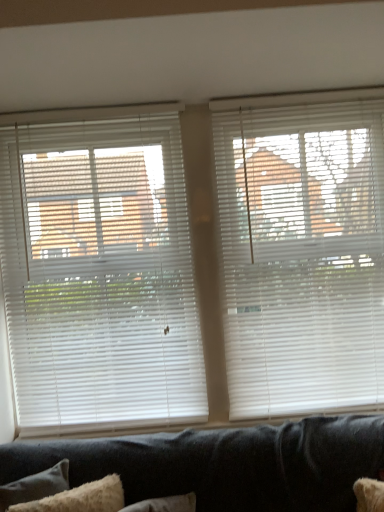
This screenshot has height=512, width=384. What do you see at coordinates (99, 272) in the screenshot? I see `white plastic blinds at left, marked as the 2th window blind in a right-to-left arrangement` at bounding box center [99, 272].

You are a GUI agent. You are given a task and a screenshot of the screen. Output one action in this format:
    pyautogui.click(x=<x>, y=<y>)
    Task: Click on the white plastic blinds at upper right, arranged as the second window blind when viewed from the left
    This screenshot has height=512, width=384.
    Given the screenshot: What is the action you would take?
    pyautogui.click(x=302, y=251)

Between white plastic blinds at left, marked as the 2th window blind in a right-to-left arrangement, and fuzzy white pillow at lower left, which one has less height?

fuzzy white pillow at lower left.

In terms of width, does white plastic blinds at left, the 1th window blind when ordered from left to right, look wider or thinner when compared to fuzzy white pillow at lower left?

white plastic blinds at left, the 1th window blind when ordered from left to right, is thinner than fuzzy white pillow at lower left.

Could you tell me if white plastic blinds at left, the 1th window blind when ordered from left to right, is turned towards fuzzy white pillow at lower left?

Yes.

From the image's perspective, would you say white plastic blinds at left, the 1th window blind when ordered from left to right, is shown under fuzzy white pillow at lower left?

No, from the image's perspective, white plastic blinds at left, the 1th window blind when ordered from left to right, is not below fuzzy white pillow at lower left.

Which object is closer to the camera taking this photo, white plastic blinds at upper right, acting as the 1th window blind starting from the right, or white plastic blinds at left, the 1th window blind when ordered from left to right?

white plastic blinds at upper right, acting as the 1th window blind starting from the right.

Which is correct: white plastic blinds at upper right, arranged as the second window blind when viewed from the left, is inside white plastic blinds at left, the 1th window blind when ordered from left to right, or outside of it?

white plastic blinds at upper right, arranged as the second window blind when viewed from the left, exists outside the volume of white plastic blinds at left, the 1th window blind when ordered from left to right.

From the image's perspective, does white plastic blinds at upper right, acting as the 1th window blind starting from the right, appear higher than white plastic blinds at left, the 1th window blind when ordered from left to right?

Yes, from the image's perspective, white plastic blinds at upper right, acting as the 1th window blind starting from the right, is on top of white plastic blinds at left, the 1th window blind when ordered from left to right.

Does point (55, 268) come closer to viewer compared to point (348, 396)?

Yes, it is in front of point (348, 396).

Is white plastic blinds at left, marked as the 2th window blind in a right-to-left arrangement, to the left or to the right of white plastic blinds at upper right, arranged as the second window blind when viewed from the left, in the image?

Based on their positions, white plastic blinds at left, marked as the 2th window blind in a right-to-left arrangement, is located to the left of white plastic blinds at upper right, arranged as the second window blind when viewed from the left.

Locate an element on the screen. The height and width of the screenshot is (512, 384). window blind in front of the white plastic blinds at left, marked as the 2th window blind in a right-to-left arrangement is located at coordinates (302, 251).

Considering the positions of objects white plastic blinds at upper right, acting as the 1th window blind starting from the right, and fuzzy white pillow at lower left in the image provided, who is behind, white plastic blinds at upper right, acting as the 1th window blind starting from the right, or fuzzy white pillow at lower left?

Positioned behind is white plastic blinds at upper right, acting as the 1th window blind starting from the right.

From a real-world perspective, who is located lower, white plastic blinds at upper right, arranged as the second window blind when viewed from the left, or fuzzy white pillow at lower left?

fuzzy white pillow at lower left is physically lower.

Is white plastic blinds at upper right, acting as the 1th window blind starting from the right, looking in the opposite direction of fuzzy white pillow at lower left?

No, white plastic blinds at upper right, acting as the 1th window blind starting from the right,'s orientation is not away from fuzzy white pillow at lower left.

Considering the positions of point (377, 162) and point (63, 501), is point (377, 162) closer or farther from the camera than point (63, 501)?

Point (377, 162).

Would you consider fuzzy white pillow at lower left to be distant from white plastic blinds at upper right, arranged as the second window blind when viewed from the left?

That's right, there is a large distance between fuzzy white pillow at lower left and white plastic blinds at upper right, arranged as the second window blind when viewed from the left.

Does fuzzy white pillow at lower left have a greater height compared to white plastic blinds at upper right, acting as the 1th window blind starting from the right?

Incorrect, the height of fuzzy white pillow at lower left is not larger of that of white plastic blinds at upper right, acting as the 1th window blind starting from the right.

Does fuzzy white pillow at lower left turn towards white plastic blinds at upper right, arranged as the second window blind when viewed from the left?

No.

The image size is (384, 512). I want to click on pillow directly beneath the white plastic blinds at upper right, acting as the 1th window blind starting from the right (from a real-world perspective), so click(80, 498).

Between point (112, 505) and point (83, 217), which one is positioned in front?

The point (112, 505) is closer to the camera.

Is fuzzy white pillow at lower left positioned far away from white plastic blinds at left, the 1th window blind when ordered from left to right?

fuzzy white pillow at lower left is actually quite close to white plastic blinds at left, the 1th window blind when ordered from left to right.

From a real-world perspective, is fuzzy white pillow at lower left physically located above or below white plastic blinds at left, the 1th window blind when ordered from left to right?

fuzzy white pillow at lower left is situated lower than white plastic blinds at left, the 1th window blind when ordered from left to right, in the real world.

Identify the location of window blind on the left of the fuzzy white pillow at lower left. This screenshot has width=384, height=512. (99, 272).

Image resolution: width=384 pixels, height=512 pixels. What are the coordinates of `window blind that is under the white plastic blinds at left, marked as the 2th window blind in a right-to-left arrangement (from a real-world perspective)` in the screenshot? It's located at (302, 251).

Looking at the image, which one is located further to fuzzy white pillow at lower left, white plastic blinds at left, marked as the 2th window blind in a right-to-left arrangement, or white plastic blinds at upper right, acting as the 1th window blind starting from the right?

Among the two, white plastic blinds at upper right, acting as the 1th window blind starting from the right, is located further to fuzzy white pillow at lower left.

Based on their spatial positions, is white plastic blinds at left, marked as the 2th window blind in a right-to-left arrangement, or fuzzy white pillow at lower left further from white plastic blinds at upper right, arranged as the second window blind when viewed from the left?

fuzzy white pillow at lower left is further to white plastic blinds at upper right, arranged as the second window blind when viewed from the left.

Considering their positions, is white plastic blinds at upper right, arranged as the second window blind when viewed from the left, positioned closer to fuzzy white pillow at lower left than white plastic blinds at left, marked as the 2th window blind in a right-to-left arrangement?

white plastic blinds at left, marked as the 2th window blind in a right-to-left arrangement, is closer to fuzzy white pillow at lower left.

When comparing their distances from white plastic blinds at upper right, acting as the 1th window blind starting from the right, does fuzzy white pillow at lower left or white plastic blinds at left, the 1th window blind when ordered from left to right, seem closer?

white plastic blinds at left, the 1th window blind when ordered from left to right, lies closer to white plastic blinds at upper right, acting as the 1th window blind starting from the right, than the other object.

Estimate the real-world distances between objects in this image. Which object is closer to white plastic blinds at left, marked as the 2th window blind in a right-to-left arrangement, white plastic blinds at upper right, acting as the 1th window blind starting from the right, or fuzzy white pillow at lower left?

Among the two, white plastic blinds at upper right, acting as the 1th window blind starting from the right, is located nearer to white plastic blinds at left, marked as the 2th window blind in a right-to-left arrangement.

Based on their spatial positions, is fuzzy white pillow at lower left or white plastic blinds at upper right, acting as the 1th window blind starting from the right, further from white plastic blinds at left, marked as the 2th window blind in a right-to-left arrangement?

fuzzy white pillow at lower left lies further to white plastic blinds at left, marked as the 2th window blind in a right-to-left arrangement, than the other object.

Image resolution: width=384 pixels, height=512 pixels. I want to click on pillow between white plastic blinds at left, marked as the 2th window blind in a right-to-left arrangement, and white plastic blinds at upper right, acting as the 1th window blind starting from the right, so click(80, 498).